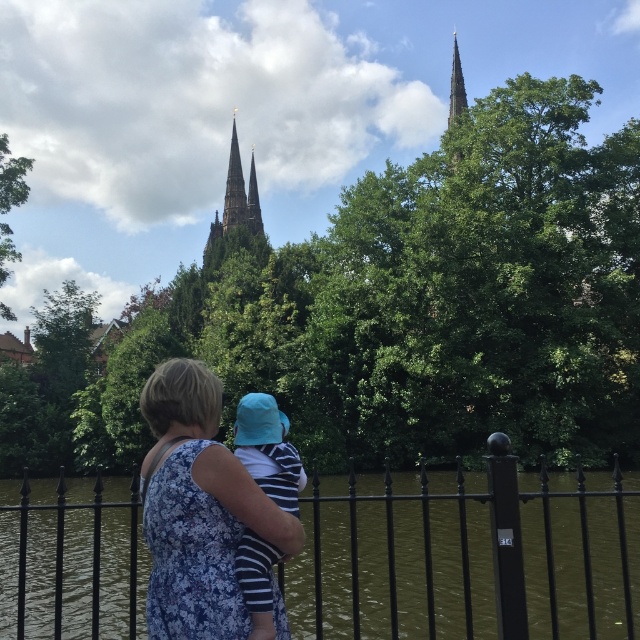
Does black wrought iron fence at center appear on the left side of blue fabric hat at center?

Yes, black wrought iron fence at center is to the left of blue fabric hat at center.

Does black wrought iron fence at center appear on the right side of blue fabric hat at center?

No, black wrought iron fence at center is not to the right of blue fabric hat at center.

Who is more forward, (x=342, y=600) or (x=236, y=416)?

Point (x=236, y=416)

You are a GUI agent. You are given a task and a screenshot of the screen. Output one action in this format:
    pyautogui.click(x=<x>, y=<y>)
    Task: Click on the black wrought iron fence at center
    This screenshot has height=640, width=640.
    Given the screenshot: What is the action you would take?
    coord(467,557)

Is blue fabric hat at center smaller than smooth stone spire at upper center?

Indeed, blue fabric hat at center has a smaller size compared to smooth stone spire at upper center.

Can you confirm if blue fabric hat at center is wider than smooth stone spire at upper center?

Incorrect, blue fabric hat at center's width does not surpass smooth stone spire at upper center's.

Is point (266, 595) positioned before point (454, 49)?

Yes, it is.

Where is `blue fabric hat at center`? The height and width of the screenshot is (640, 640). blue fabric hat at center is located at coordinates (268, 449).

Is blue fabric hat at center positioned in front of dark gray stone tower at upper center?

That is True.

Does point (248, 420) lie behind point (230, 236)?

No, it is not.

I want to click on blue fabric hat at center, so click(268, 449).